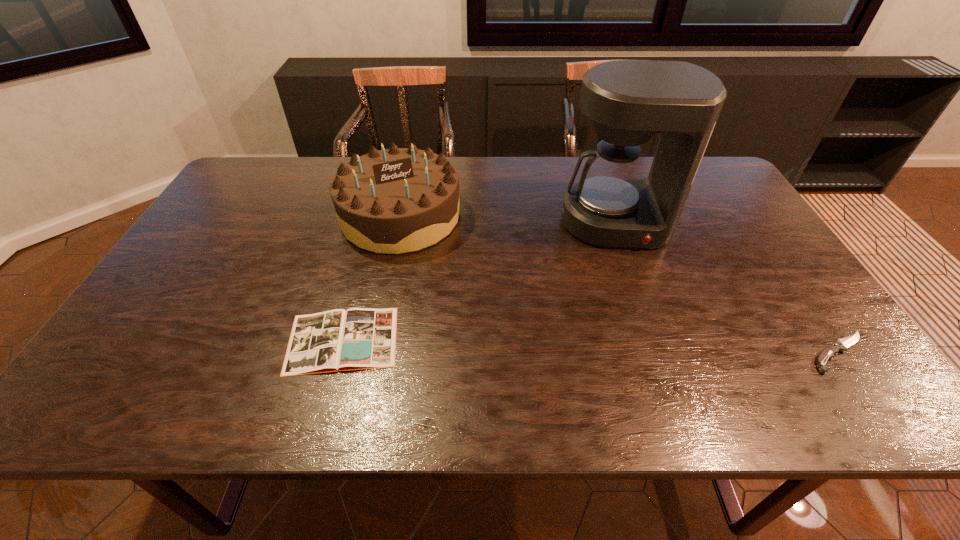
Where is `book`? book is located at coordinates (337, 340).

Where is `the rightmost object`? the rightmost object is located at coordinates [x=827, y=353].

At what (x,y) coordinates should I click in order to perform the action: click on the second tallest object. Please return your answer as a coordinate pair (x, y). The height and width of the screenshot is (540, 960). Looking at the image, I should click on (398, 200).

Where is `coffee maker`? This screenshot has width=960, height=540. coffee maker is located at coordinates (612, 206).

The width and height of the screenshot is (960, 540). Find the location of `the second object from right to left`. the second object from right to left is located at coordinates (612, 206).

Identify the location of vacant space positioned on the left of the book. This screenshot has width=960, height=540. pos(150,340).

In order to click on free space located 0.380m on the back of the pocketknife in this screenshot , I will do `click(753, 228)`.

In order to click on free space located 0.240m on the front-facing side of the birthday cake in this screenshot , I will do `click(492, 294)`.

Where is `vacant space located on the front-facing side of the birthday cake`? Image resolution: width=960 pixels, height=540 pixels. vacant space located on the front-facing side of the birthday cake is located at coordinates (472, 276).

Identify the location of vacant point located on the front-facing side of the birthday cake. (458, 265).